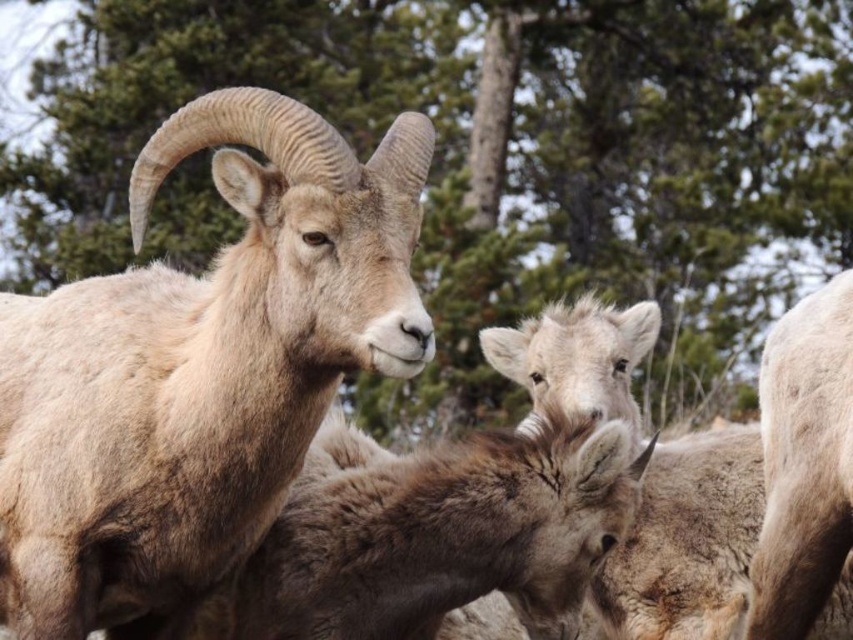
You are a hiker who has spotted a light brown woolly goat at left in the mountains. You want to take a photo of it but need to stay at least 50 meters away to avoid disturbing it. If you are standing at point (199, 369), which is where the goat is located, can you safely take the photo from your current position?

No, you cannot safely take the photo from your current position because you are at the same location as the light brown woolly goat at left, meaning you are not maintaining the required 50 meters distance.